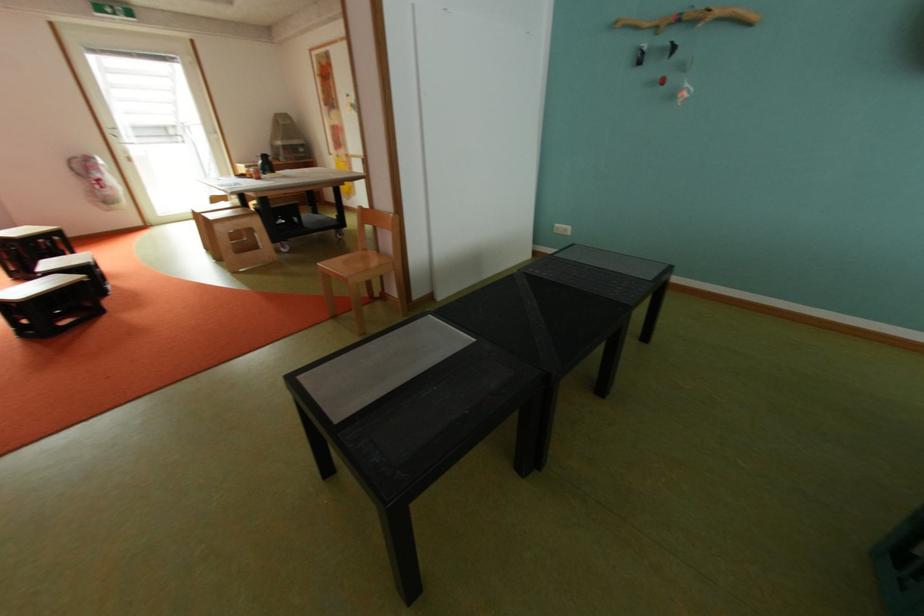
Find where to lift the black pitcher. Please return your answer as a coordinate pair (x, y).

(265, 164)